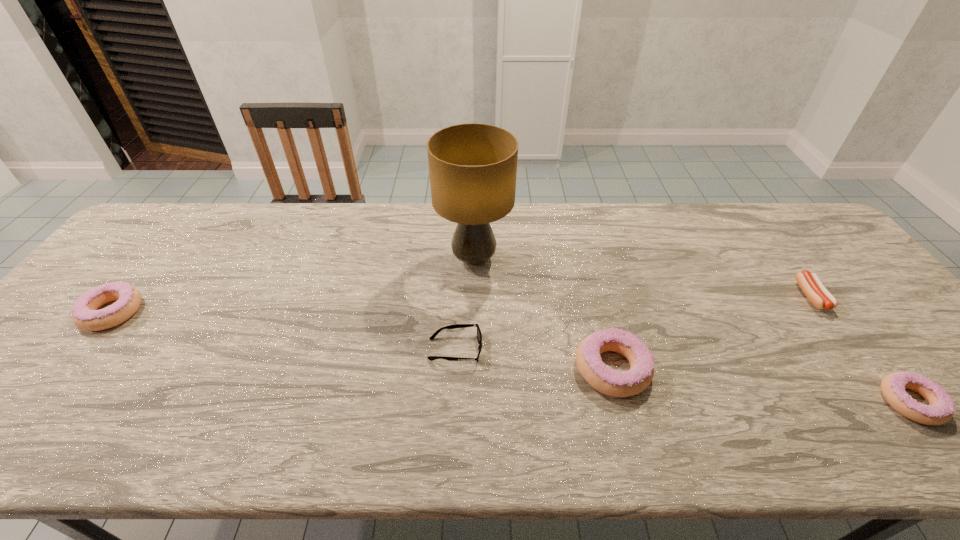
The image size is (960, 540). Find the location of `doughnut identified as the closest to the tallest object`. doughnut identified as the closest to the tallest object is located at coordinates (601, 377).

Identify the location of blank area in the image that satisfies the following two spatial constraints: 1. on the front side of the sausage; 2. on the front-facing side of the shortest object. (851, 349).